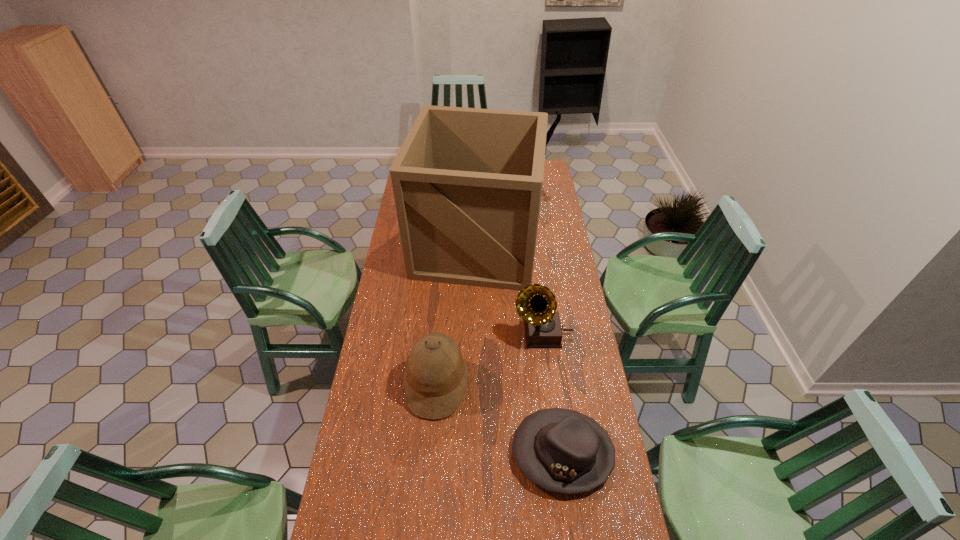
Locate an element on the screen. The height and width of the screenshot is (540, 960). box is located at coordinates (467, 182).

This screenshot has height=540, width=960. Identify the location of the tallest object. (467, 182).

The width and height of the screenshot is (960, 540). I want to click on the farthest object, so click(x=550, y=132).

Locate an element on the screen. cat is located at coordinates click(x=550, y=132).

Locate an element on the screen. The image size is (960, 540). phonograph record is located at coordinates (536, 304).

The height and width of the screenshot is (540, 960). Identify the location of the taller hat. (435, 377).

The width and height of the screenshot is (960, 540). Find the location of `the shortest object`. the shortest object is located at coordinates (564, 451).

Where is `the right hat`? The image size is (960, 540). the right hat is located at coordinates (564, 451).

Find the location of a particular element. This screenshot has width=960, height=540. vacant area located 0.060m on the left of the box is located at coordinates (400, 245).

This screenshot has height=540, width=960. In order to click on free region located 0.150m on the face of the farthest object in this screenshot , I will do `click(461, 178)`.